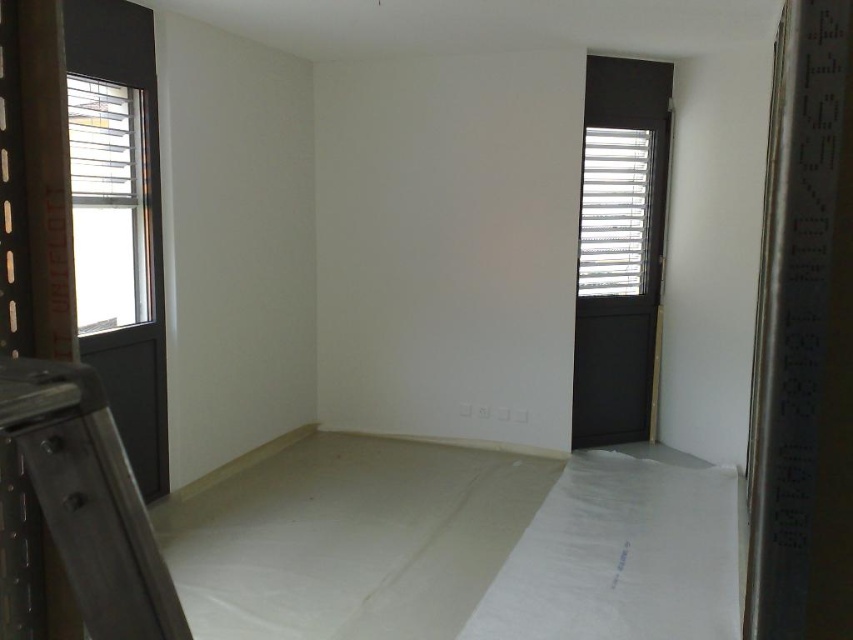
You are a contractor assessing the space. You need to determine which object, the matte black door at right or the clear glass window at left, requires more material to cover completely with a protective film. Based on the scene description, which one would need more material?

The matte black door at right is larger in size than the clear glass window at left, so it would require more material to cover completely with a protective film.

You are a painter needing to reach a high ceiling. You see a metallic black ladder at lower left and a matte black door at right. Which object can you use to reach higher?

The metallic black ladder at lower left can reach higher than the matte black door at right since it is taller than the door.

You are standing in the middle of the room and want to exit through either the matte black door at right or the clear glass window at left. Which one is closer to you?

The matte black door at right is closer to you because it is further to the viewer than the clear glass window at left, meaning it is nearer in your perspective.